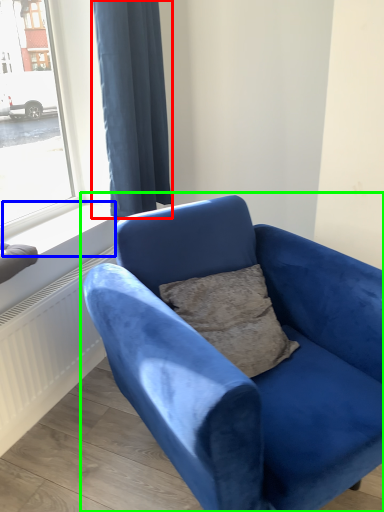
Question: Which object is the closest to the curtain (highlighted by a red box)? Choose among these: window sill (highlighted by a blue box) or studio couch (highlighted by a green box).

Choices:
 (A) window sill
 (B) studio couch

Answer: (A)